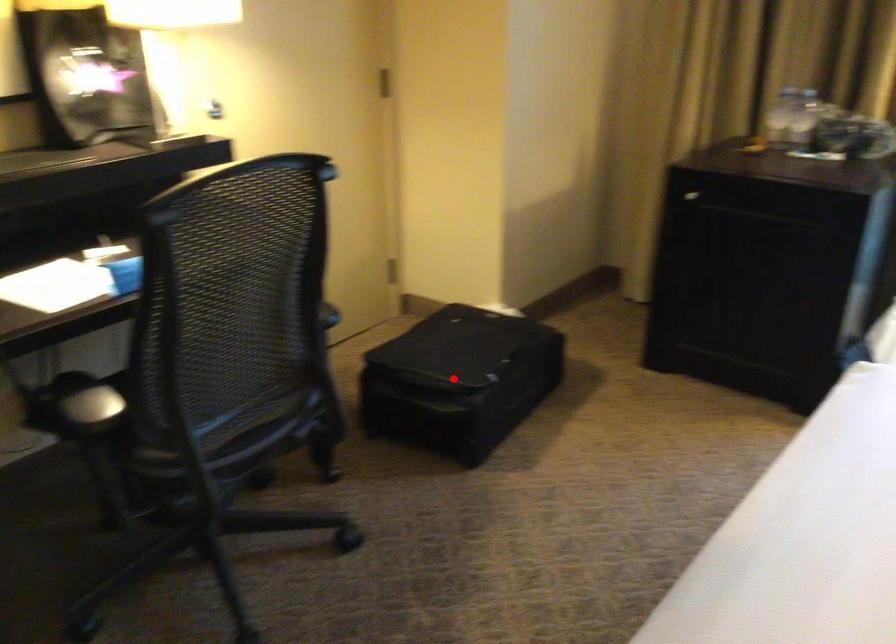
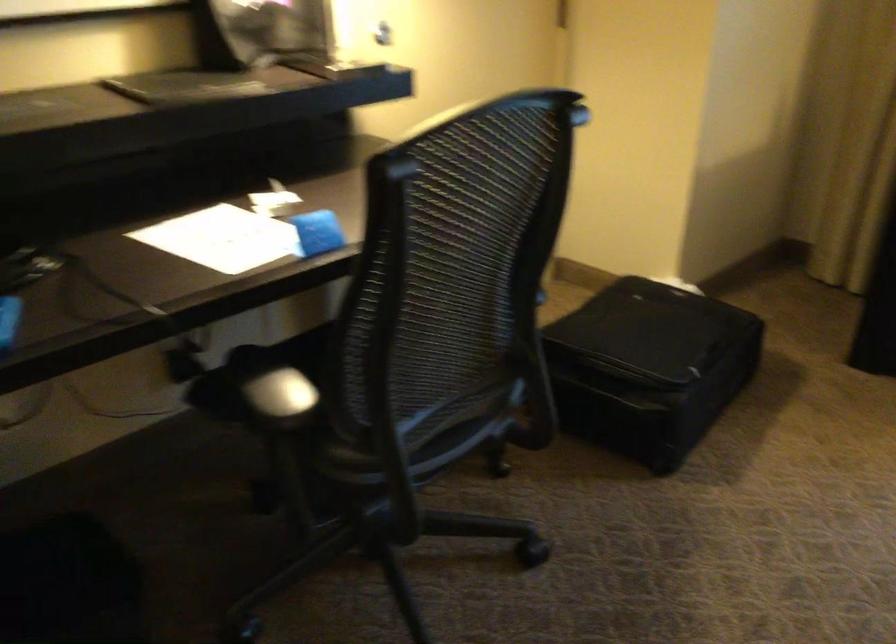
The point at the highlighted location is marked in the first image. Where is the corresponding point in the second image?

(649, 366)